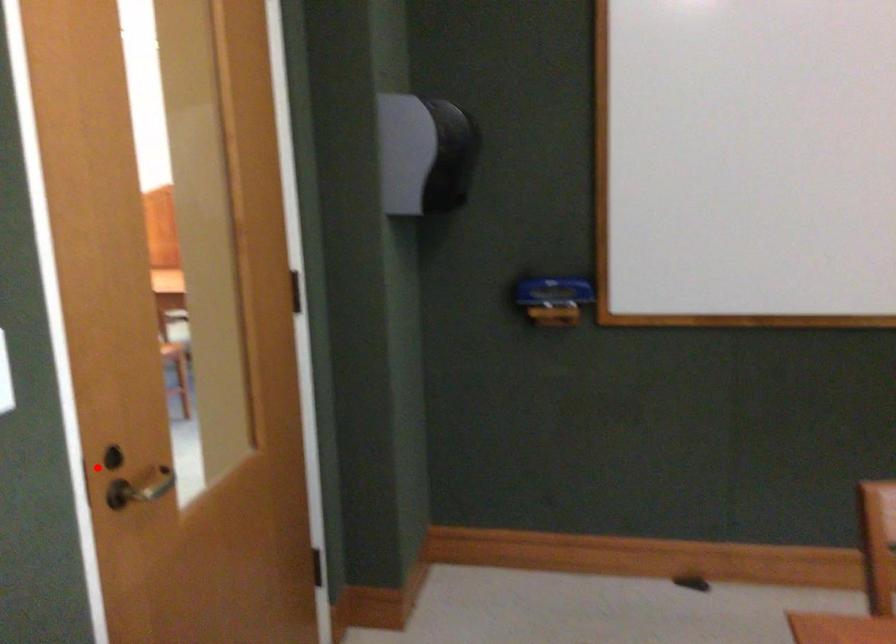
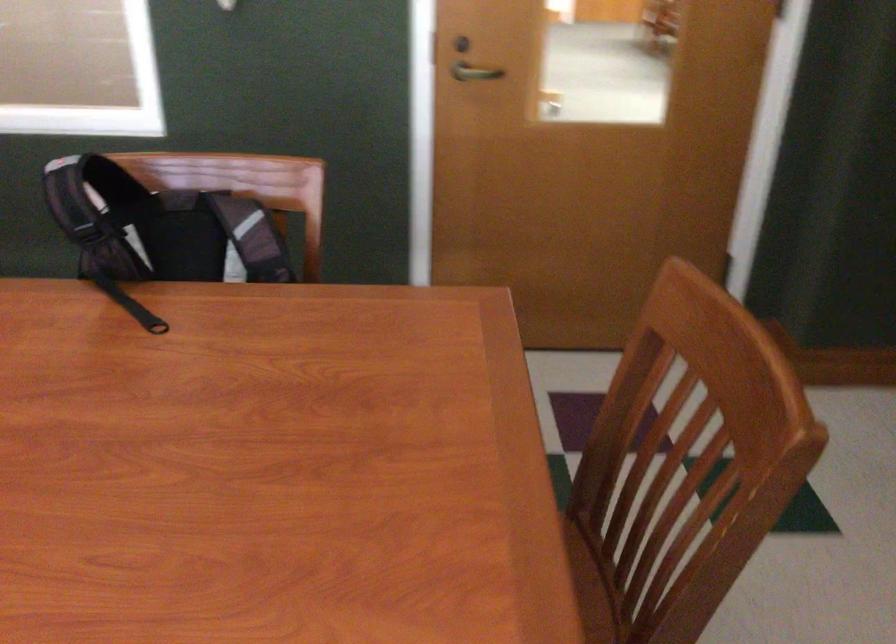
Question: I am providing you with two images of the same scene from different viewpoints. Image1 has a red point marked. In image2, the corresponding 3D location appears at what relative position? Reply with the corresponding letter.

Choices:
 (A) Closer
 (B) Farther

Answer: (B)